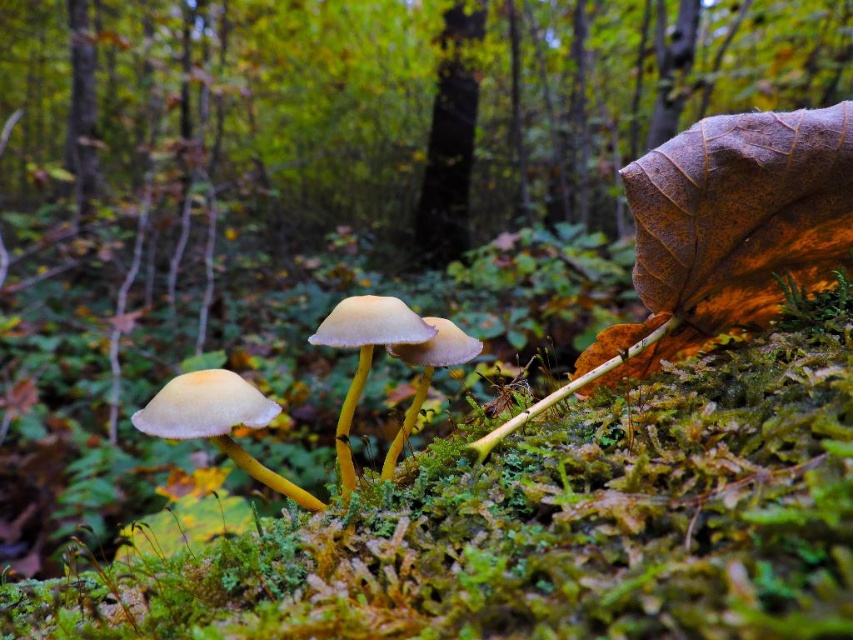
Based on the photo, you are a tiny explorer standing at the center of the mossy ground. You see a brown leaf at upper right marked by point (393, 99). If you walk straight towards the direction of the point, will you reach the leaf before encountering any mushrooms?

The brown leaf at upper right is represented by point (393, 99), so walking straight towards that point would lead you directly to the leaf without encountering any mushrooms first.

You are a forest explorer who wants to place a small marker between the brown leaf at upper right and the smooth bark tree at center. Based on their positions, which object is closer to the left side of the scene?

The brown leaf at upper right is positioned on the left side of smooth bark tree at center, so the brown leaf at upper right is closer to the left side of the scene.